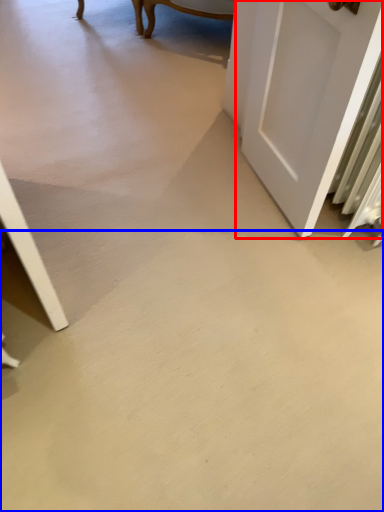
Question: Which object appears closest to the camera in this image, door (highlighted by a red box) or concrete (highlighted by a blue box)?

Choices:
 (A) door
 (B) concrete

Answer: (B)